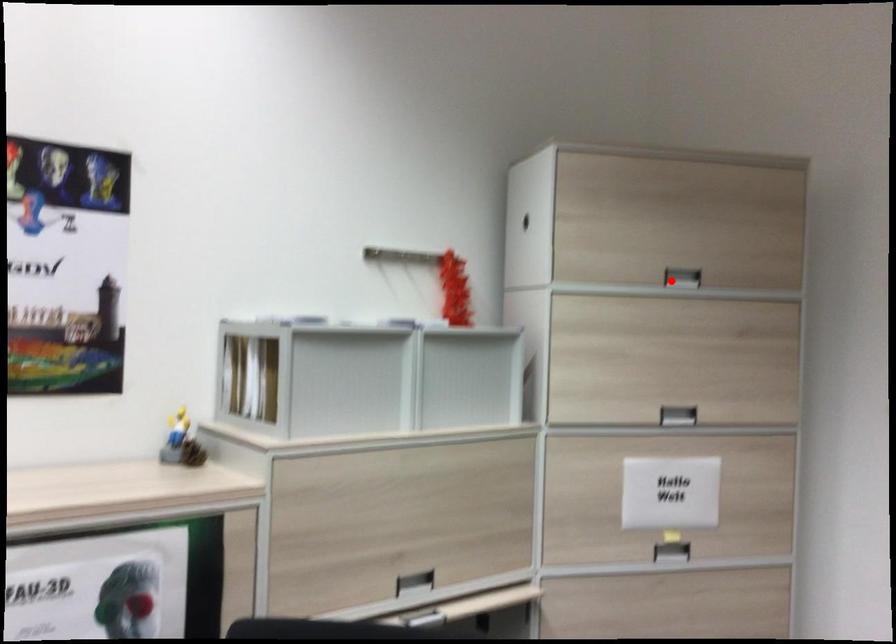
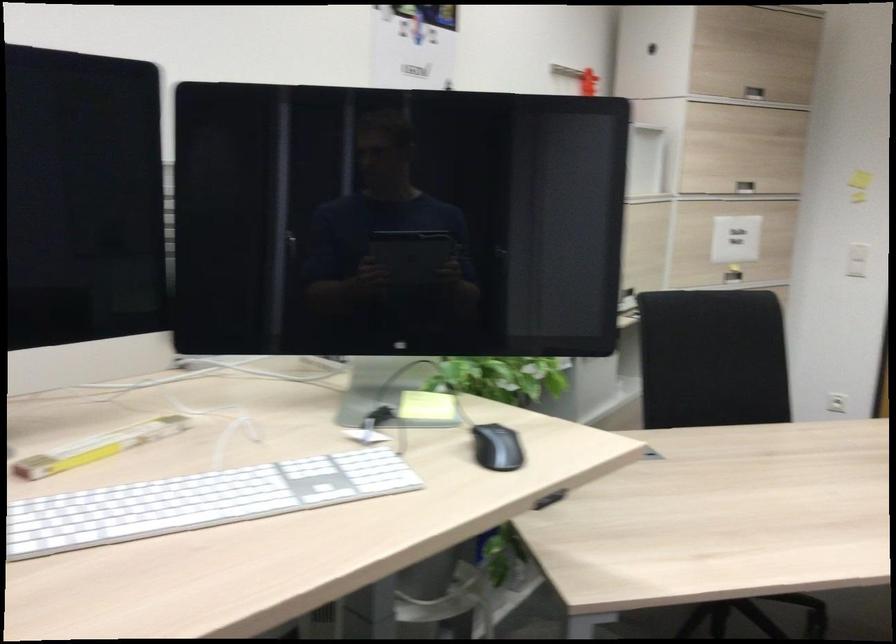
The point at the highlighted location is marked in the first image. Where is the corresponding point in the second image?

(754, 93)